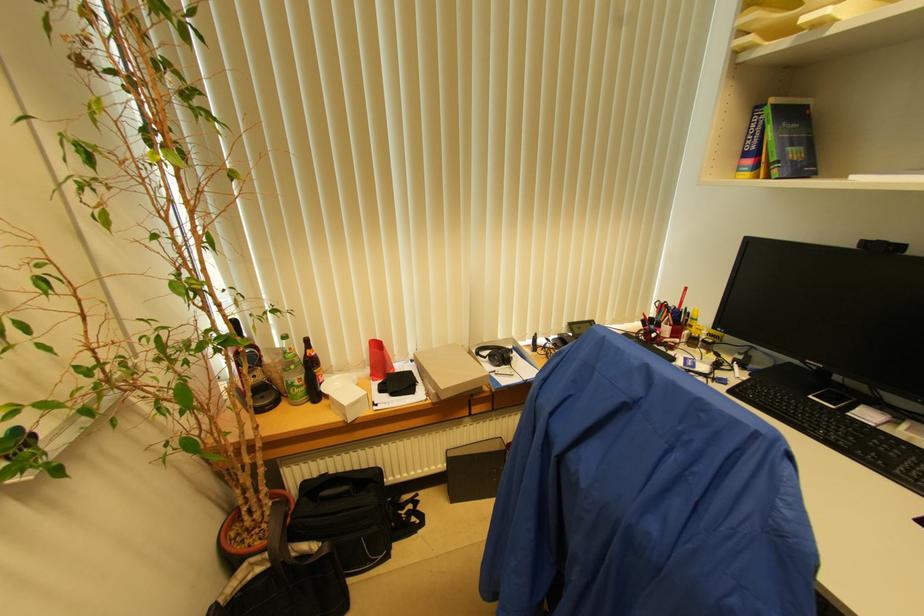
The height and width of the screenshot is (616, 924). In order to click on red pen in this screenshot , I will do `click(682, 297)`.